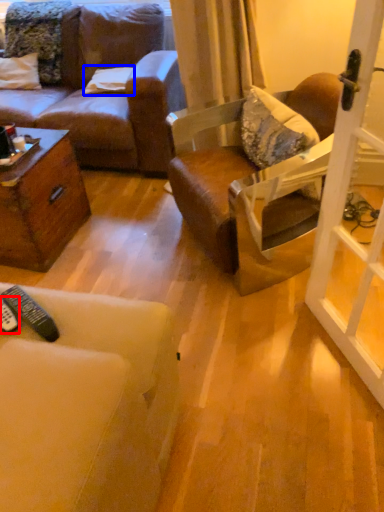
Question: Which object is closer to the camera taking this photo, remote control (highlighted by a red box) or pillow (highlighted by a blue box)?

Choices:
 (A) remote control
 (B) pillow

Answer: (A)